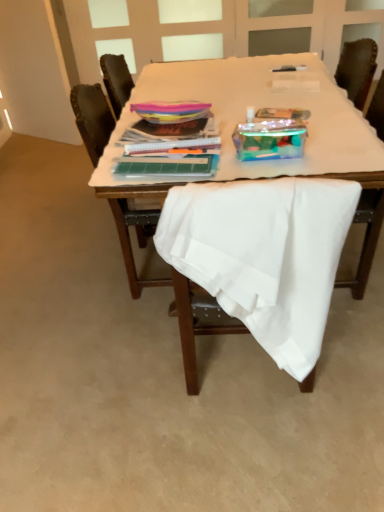
You are a GUI agent. You are given a task and a screenshot of the screen. Output one action in this format:
    pyautogui.click(x=<x>, y=<y>)
    Task: Click on the white fabric-covered table at center
    
    Given the screenshot: What is the action you would take?
    pyautogui.click(x=245, y=117)

What do you see at coordinates (245, 117) in the screenshot?
I see `white fabric-covered table at center` at bounding box center [245, 117].

The height and width of the screenshot is (512, 384). Find the location of `white fabric-covered table at center`. white fabric-covered table at center is located at coordinates (280, 104).

At what (x,y) coordinates should I click in order to perform the action: click on white fabric chair at center, the 1th chair viewed from the front. Please return your answer as a coordinate pair (x, y). The height and width of the screenshot is (512, 384). Looking at the image, I should click on (264, 255).

Is white fabric-covered table at center to the left or to the right of white fabric-covered table at center in the image?

white fabric-covered table at center is to the right of white fabric-covered table at center.

How much distance is there between white fabric-covered table at center and white fabric-covered table at center?

white fabric-covered table at center and white fabric-covered table at center are 1.20 inches apart.

Considering the sizes of objects white fabric-covered table at center and white fabric-covered table at center in the image provided, who is smaller, white fabric-covered table at center or white fabric-covered table at center?

Smaller between the two is white fabric-covered table at center.

Find the location of a particular element. This screenshot has height=512, width=384. table behind the white fabric-covered table at center is located at coordinates (280, 104).

Who is shorter, white fabric chair at center, marked as the 2th chair in a back-to-front arrangement, or wooden chair at center, placed as the 1th chair when sorted from back to front?

With less height is white fabric chair at center, marked as the 2th chair in a back-to-front arrangement.

At what (x,y) coordinates should I click in order to perform the action: click on chair located above the white fabric chair at center, the 1th chair viewed from the front (from the image's perspective). Please return your answer as a coordinate pair (x, y). The height and width of the screenshot is (512, 384). Looking at the image, I should click on (92, 118).

From a real-world perspective, relative to wooden chair at center, acting as the second chair starting from the front, is white fabric chair at center, the 1th chair viewed from the front, vertically above or below?

white fabric chair at center, the 1th chair viewed from the front, is above wooden chair at center, acting as the second chair starting from the front.

In the scene shown: Are white fabric-covered table at center and wooden chair at center, placed as the 1th chair when sorted from back to front, making contact?

white fabric-covered table at center and wooden chair at center, placed as the 1th chair when sorted from back to front, are clearly separated.

Is white fabric-covered table at center bigger or smaller than wooden chair at center, placed as the 1th chair when sorted from back to front?

Considering their sizes, white fabric-covered table at center takes up less space than wooden chair at center, placed as the 1th chair when sorted from back to front.

From the image's perspective, which is below, white fabric-covered table at center or wooden chair at center, placed as the 1th chair when sorted from back to front?

wooden chair at center, placed as the 1th chair when sorted from back to front, is shown below in the image.

Considering the relative sizes of white fabric-covered table at center and wooden chair at center, placed as the 1th chair when sorted from back to front, in the image provided, is white fabric-covered table at center thinner than wooden chair at center, placed as the 1th chair when sorted from back to front,?

No.

Is wooden chair at center, acting as the second chair starting from the front, at the back of white fabric-covered table at center?

No.

What's the angular difference between white fabric-covered table at center and wooden chair at center, placed as the 1th chair when sorted from back to front,'s facing directions?

white fabric-covered table at center and wooden chair at center, placed as the 1th chair when sorted from back to front, are facing 87.1 degrees away from each other.

Can you confirm if white fabric-covered table at center is thinner than wooden chair at center, acting as the second chair starting from the front?

No.

Between white fabric-covered table at center and wooden chair at center, placed as the 1th chair when sorted from back to front, which one has smaller size?

Smaller between the two is wooden chair at center, placed as the 1th chair when sorted from back to front.

Based on the photo, is white fabric chair at center, the 1th chair viewed from the front, positioned beyond the bounds of white fabric-covered table at center?

Absolutely, white fabric chair at center, the 1th chair viewed from the front, is external to white fabric-covered table at center.

Would you say white fabric chair at center, the 1th chair viewed from the front, is to the left or to the right of white fabric-covered table at center in the picture?

Based on their positions, white fabric chair at center, the 1th chair viewed from the front, is located to the left of white fabric-covered table at center.

From the image's perspective, is white fabric chair at center, marked as the 2th chair in a back-to-front arrangement, located above or below white fabric-covered table at center?

white fabric chair at center, marked as the 2th chair in a back-to-front arrangement, is situated lower than white fabric-covered table at center in the image.

Which object is more forward, white fabric-covered table at center or white fabric chair at center, marked as the 2th chair in a back-to-front arrangement?

Positioned in front is white fabric chair at center, marked as the 2th chair in a back-to-front arrangement.

From the image's perspective, which is below, white fabric-covered table at center or white fabric chair at center, marked as the 2th chair in a back-to-front arrangement?

white fabric chair at center, marked as the 2th chair in a back-to-front arrangement, appears lower in the image.

Is white fabric-covered table at center bigger or smaller than white fabric chair at center, the 1th chair viewed from the front?

Clearly, white fabric-covered table at center is larger in size than white fabric chair at center, the 1th chair viewed from the front.

Does white fabric-covered table at center have a greater width compared to white fabric chair at center, the 1th chair viewed from the front?

Yes.

The height and width of the screenshot is (512, 384). Find the location of `round table that is above the white fabric chair at center, the 1th chair viewed from the front (from a real-world perspective)`. round table that is above the white fabric chair at center, the 1th chair viewed from the front (from a real-world perspective) is located at coordinates (245, 117).

Between white fabric chair at center, marked as the 2th chair in a back-to-front arrangement, and white fabric-covered table at center, which one has less height?

Standing shorter between the two is white fabric-covered table at center.

Does point (266, 239) come closer to viewer compared to point (165, 188)?

Yes, it is.

Does white fabric chair at center, marked as the 2th chair in a back-to-front arrangement, touch white fabric-covered table at center?

No.

At what (x,y) coordinates should I click in order to perform the action: click on round table above the white fabric-covered table at center (from a real-world perspective). Please return your answer as a coordinate pair (x, y). The height and width of the screenshot is (512, 384). Looking at the image, I should click on (245, 117).

You are a GUI agent. You are given a task and a screenshot of the screen. Output one action in this format:
    pyautogui.click(x=<x>, y=<y>)
    Task: Click on the chair on the right of wooden chair at center, acting as the second chair starting from the front
    This screenshot has width=384, height=512.
    Given the screenshot: What is the action you would take?
    pyautogui.click(x=264, y=255)

Which object lies further to the anchor point wooden chair at center, acting as the second chair starting from the front, white fabric-covered table at center or white fabric-covered table at center?

white fabric-covered table at center is positioned further to the anchor wooden chair at center, acting as the second chair starting from the front.

From the picture: When comparing their distances from white fabric-covered table at center, does white fabric-covered table at center or wooden chair at center, placed as the 1th chair when sorted from back to front, seem closer?

white fabric-covered table at center is positioned closer to the anchor white fabric-covered table at center.

Estimate the real-world distances between objects in this image. Which object is closer to white fabric-covered table at center, white fabric chair at center, the 1th chair viewed from the front, or white fabric-covered table at center?

The object closer to white fabric-covered table at center is white fabric-covered table at center.

Considering their positions, is white fabric chair at center, the 1th chair viewed from the front, positioned further to white fabric-covered table at center than white fabric-covered table at center?

white fabric chair at center, the 1th chair viewed from the front.

Estimate the real-world distances between objects in this image. Which object is closer to white fabric-covered table at center, wooden chair at center, placed as the 1th chair when sorted from back to front, or white fabric chair at center, the 1th chair viewed from the front?

The object closer to white fabric-covered table at center is wooden chair at center, placed as the 1th chair when sorted from back to front.

From the image, which object appears to be nearer to white fabric-covered table at center, wooden chair at center, placed as the 1th chair when sorted from back to front, or white fabric chair at center, the 1th chair viewed from the front?

wooden chair at center, placed as the 1th chair when sorted from back to front, is closer to white fabric-covered table at center.

Which object lies further to the anchor point white fabric chair at center, marked as the 2th chair in a back-to-front arrangement, white fabric-covered table at center or wooden chair at center, placed as the 1th chair when sorted from back to front?

wooden chair at center, placed as the 1th chair when sorted from back to front, is positioned further to the anchor white fabric chair at center, marked as the 2th chair in a back-to-front arrangement.

From the image, which object appears to be nearer to white fabric-covered table at center, white fabric-covered table at center or white fabric chair at center, marked as the 2th chair in a back-to-front arrangement?

white fabric-covered table at center.

At what (x,y) coordinates should I click in order to perform the action: click on table that lies between white fabric-covered table at center and white fabric chair at center, the 1th chair viewed from the front, from top to bottom. Please return your answer as a coordinate pair (x, y). Looking at the image, I should click on (280, 104).

This screenshot has height=512, width=384. Identify the location of chair between white fabric-covered table at center and white fabric chair at center, the 1th chair viewed from the front, vertically. (92, 118).

Where is `round table between wooden chair at center, acting as the second chair starting from the front, and white fabric-covered table at center, in the horizontal direction`? Image resolution: width=384 pixels, height=512 pixels. round table between wooden chair at center, acting as the second chair starting from the front, and white fabric-covered table at center, in the horizontal direction is located at coordinates (245, 117).

This screenshot has height=512, width=384. Find the location of `table between white fabric chair at center, marked as the 2th chair in a back-to-front arrangement, and wooden chair at center, placed as the 1th chair when sorted from back to front, in the front-back direction`. table between white fabric chair at center, marked as the 2th chair in a back-to-front arrangement, and wooden chair at center, placed as the 1th chair when sorted from back to front, in the front-back direction is located at coordinates (280, 104).